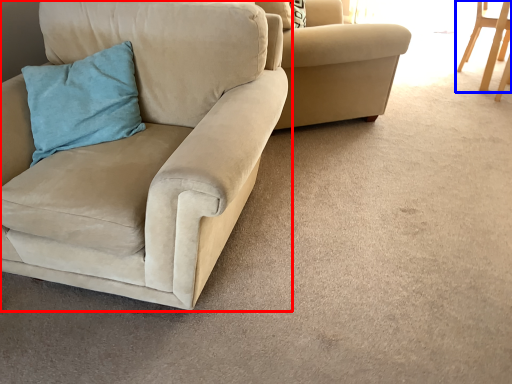
Question: Which object appears farthest to the camera in this image, chair (highlighted by a red box) or chair (highlighted by a blue box)?

Choices:
 (A) chair
 (B) chair

Answer: (B)